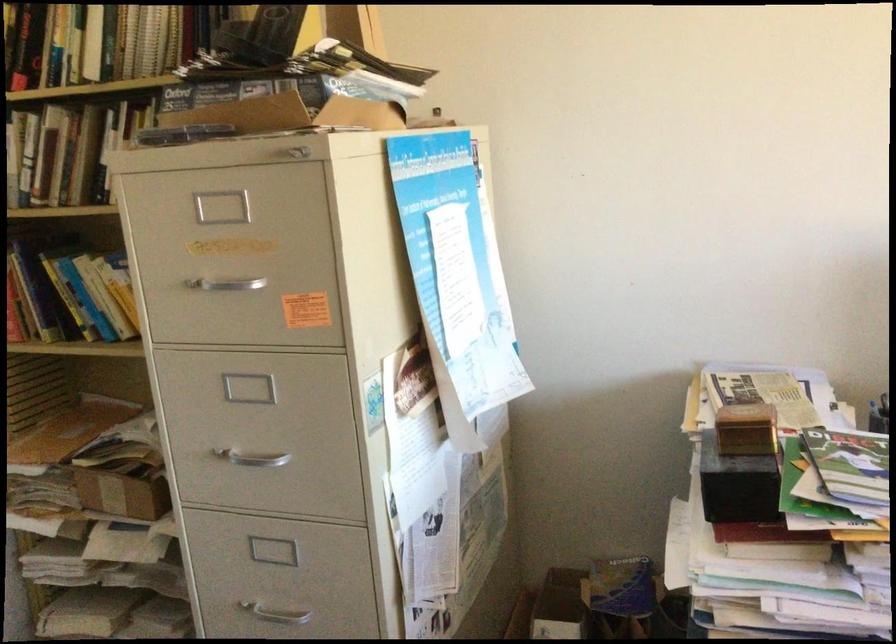
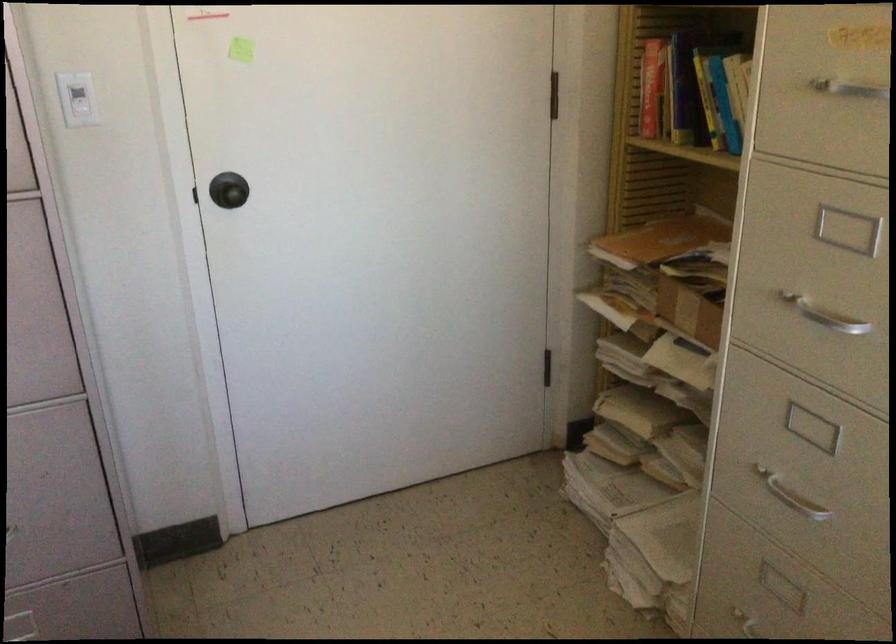
Locate, in the second image, the point that corresponds to point (116, 494) in the first image.

(688, 310)